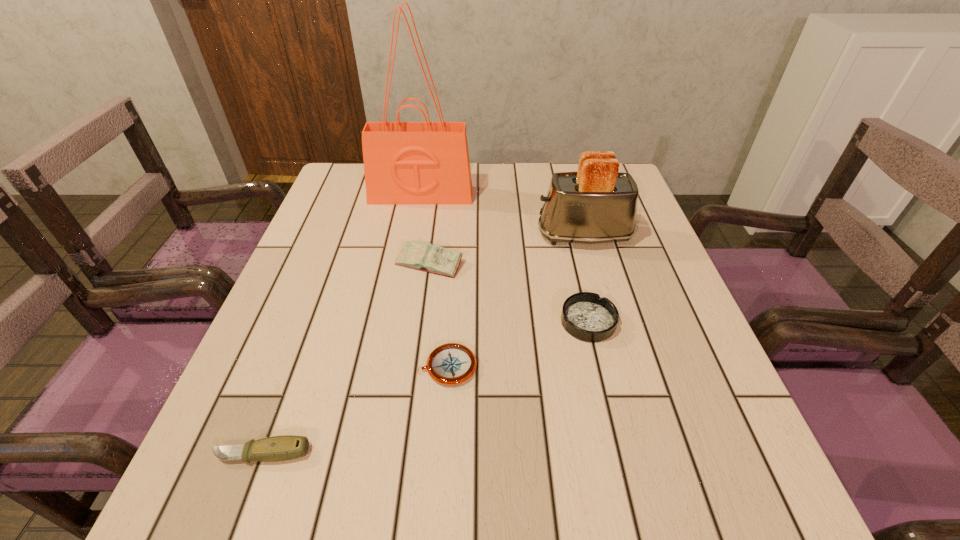
At what (x,y) coordinates should I click in order to perform the action: click on free point that satisfies the following two spatial constraints: 1. on the side of the toaster with the control lever; 2. on the front side of the fifth farthest object. Please return your answer as a coordinate pair (x, y). Looking at the image, I should click on (621, 367).

The width and height of the screenshot is (960, 540). I want to click on vacant area that satisfies the following two spatial constraints: 1. on the back side of the pocketknife; 2. on the right side of the third nearest object, so click(311, 322).

Image resolution: width=960 pixels, height=540 pixels. What are the coordinates of `vacant space that satisfies the following two spatial constraints: 1. on the logo side of the tote bag; 2. on the right side of the compass` in the screenshot? It's located at (391, 367).